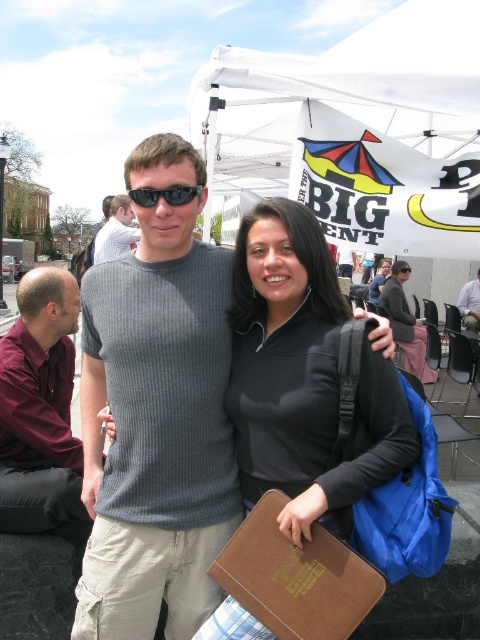
Is gray ribbed t-shirt at center further to the viewer compared to maroon shirt at left?

No, gray ribbed t-shirt at center is closer to the viewer.

This screenshot has height=640, width=480. What do you see at coordinates (156, 416) in the screenshot?
I see `gray ribbed t-shirt at center` at bounding box center [156, 416].

Where is `gray ribbed t-shirt at center`? The width and height of the screenshot is (480, 640). gray ribbed t-shirt at center is located at coordinates (156, 416).

Does maroon shirt at left appear on the left side of black matte sunglasses at center?

Correct, you'll find maroon shirt at left to the left of black matte sunglasses at center.

Based on the photo, can you confirm if maroon shirt at left is positioned above black matte sunglasses at center?

No.

The image size is (480, 640). Identify the location of maroon shirt at left. (40, 412).

Between gray ribbed t-shirt at center and black matte sunglasses at center, which one appears on the right side from the viewer's perspective?

black matte sunglasses at center

Who is shorter, gray ribbed t-shirt at center or black matte sunglasses at center?

black matte sunglasses at center

Describe the element at coordinates (156, 416) in the screenshot. The image size is (480, 640). I see `gray ribbed t-shirt at center` at that location.

Locate an element on the screen. gray ribbed t-shirt at center is located at coordinates (156, 416).